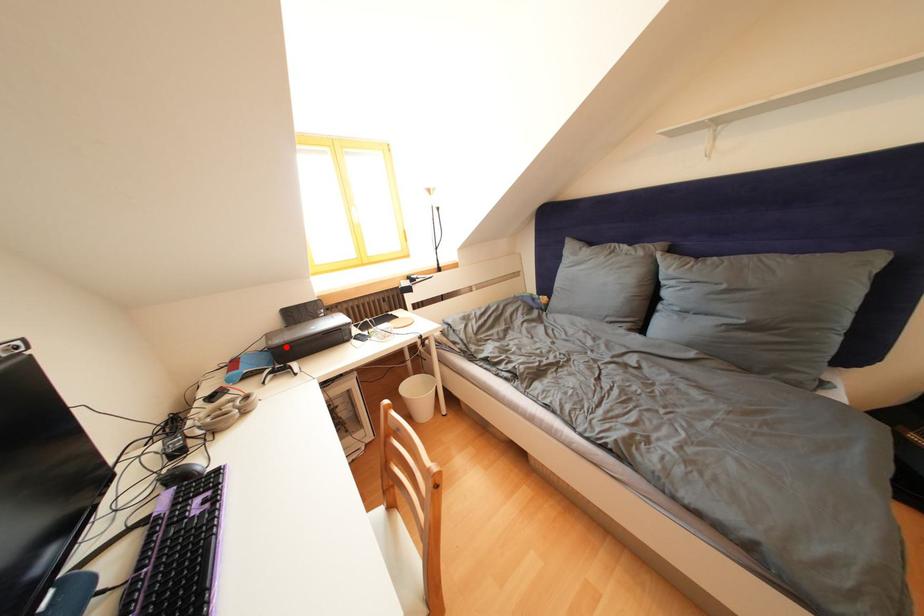
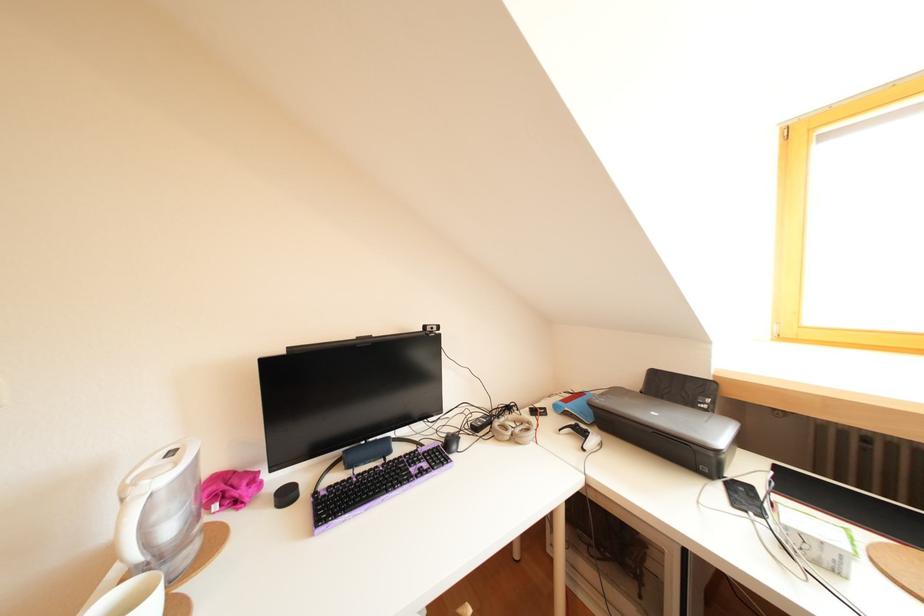
Where in the second image is the point corresponding to the highlighted location from the first image?

(610, 407)